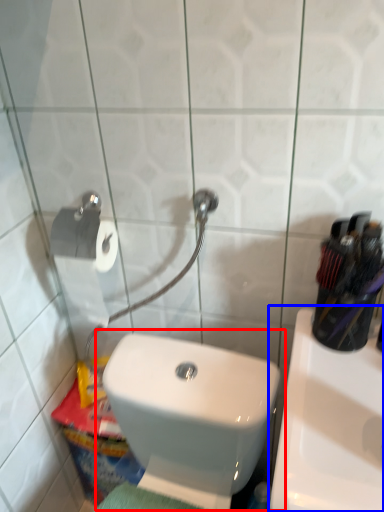
Question: Which object appears closest to the camera in this image, toilet (highlighted by a red box) or sink (highlighted by a blue box)?

Choices:
 (A) toilet
 (B) sink

Answer: (A)